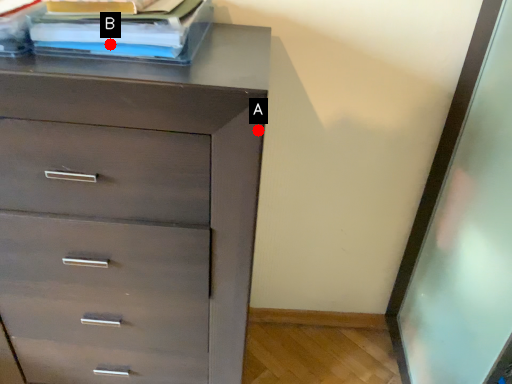
Question: Two points are circled on the image, labeled by A and B beside each circle. Among these points, which one is nearest to the camera?

Choices:
 (A) A is closer
 (B) B is closer

Answer: (A)